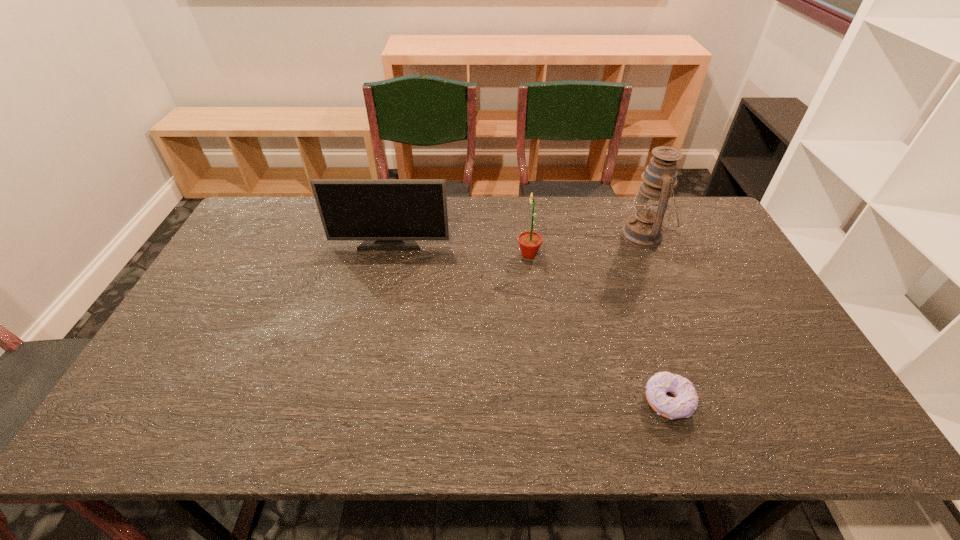
Identify the location of free space that is in between the sunflower and the nearest object. The height and width of the screenshot is (540, 960). (598, 328).

Find the location of a particular element. The height and width of the screenshot is (540, 960). free space between the monitor and the tallest object is located at coordinates (517, 239).

The height and width of the screenshot is (540, 960). I want to click on unoccupied position between the sunflower and the oil lamp, so click(587, 245).

This screenshot has width=960, height=540. I want to click on vacant space in between the oil lamp and the sunflower, so (587, 245).

Find the location of a particular element. The image size is (960, 540). free point between the oil lamp and the shortest object is located at coordinates (656, 318).

Locate an element on the screen. The width and height of the screenshot is (960, 540). free point between the doughnut and the monitor is located at coordinates (529, 322).

Where is `vacant area that lies between the shortest object and the tallest object`? vacant area that lies between the shortest object and the tallest object is located at coordinates (656, 318).

The height and width of the screenshot is (540, 960). I want to click on unoccupied area between the monitor and the oil lamp, so [517, 239].

You are a GUI agent. You are given a task and a screenshot of the screen. Output one action in this format:
    pyautogui.click(x=<x>, y=<y>)
    Task: Click on the free area in between the oil lamp and the leftmost object
    
    Given the screenshot: What is the action you would take?
    pyautogui.click(x=517, y=239)

Identify the location of unoccupied position between the doughnut and the tallest object. The height and width of the screenshot is (540, 960). (656, 318).